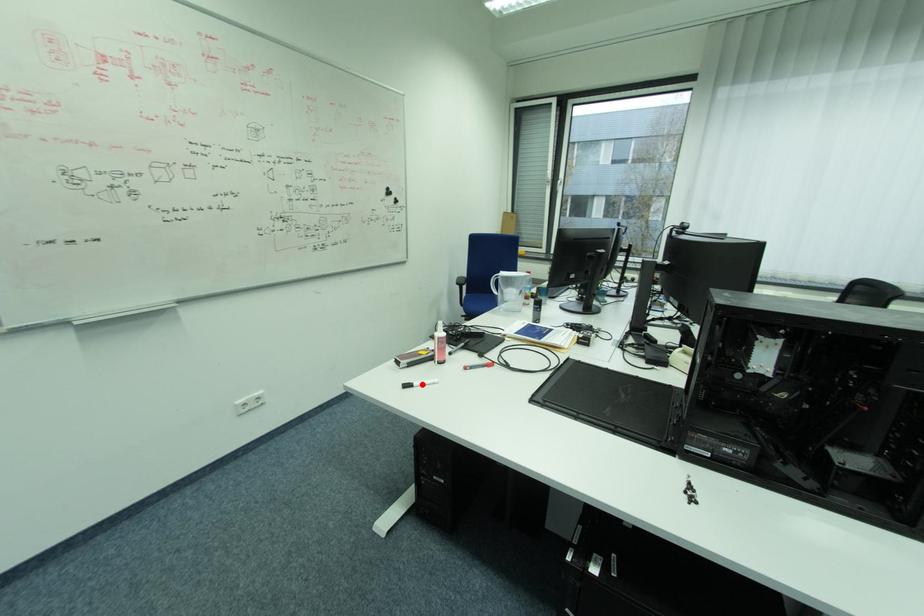
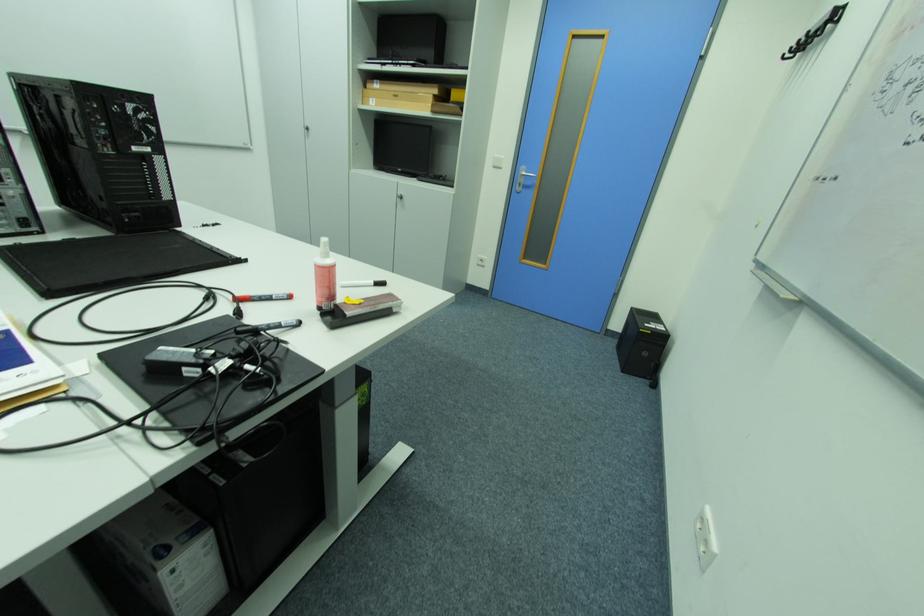
Question: I am providing you with two images of the same scene from different viewpoints. A red point is marked on the first image. At the location where the point appears in image 1, is it still visible in image 2?

Choices:
 (A) Yes
 (B) No

Answer: (B)